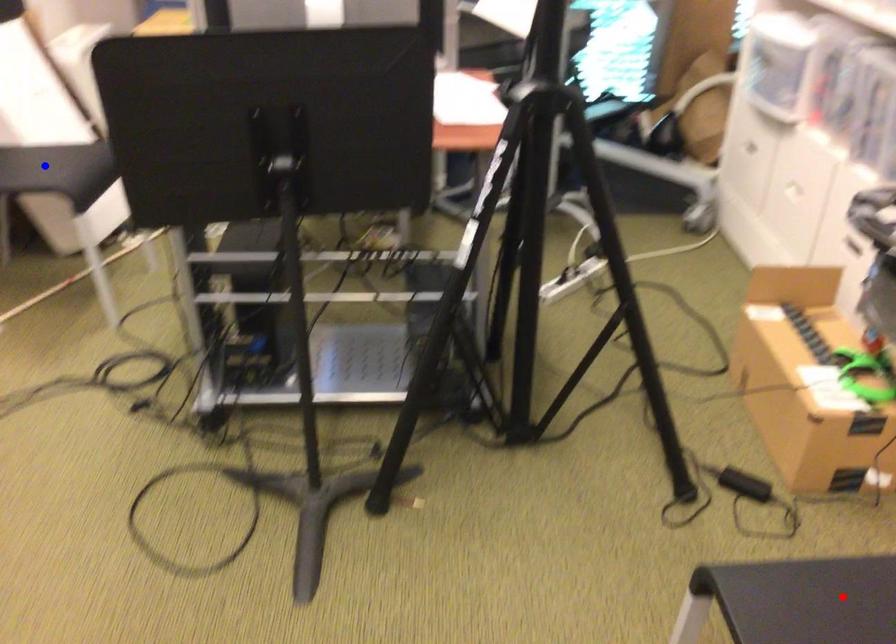
Question: In the image, two points are highlighted. Which point is nearer to the camera? Reply with the corresponding letter.

Choices:
 (A) blue point
 (B) red point

Answer: (B)